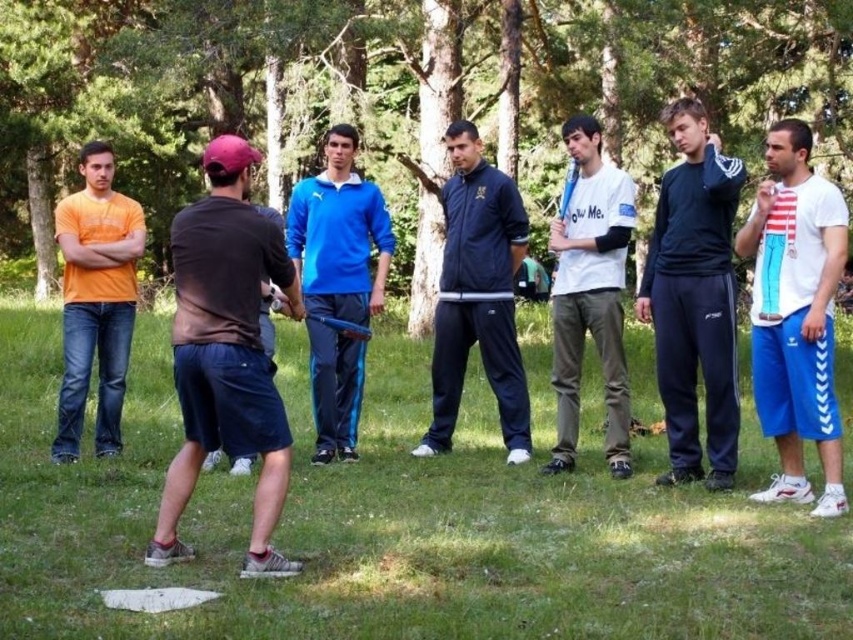
You are a photographer trying to capture a candid shot of the two individuals wearing dark blue track pants at center and navy blue tracksuit at center. Since you want to focus on the person closer to you, which one should you aim your camera at?

The dark blue track pants at center is closer to the viewer than the navy blue tracksuit at center, so you should aim your camera at the dark blue track pants at center to focus on the person closer to you.